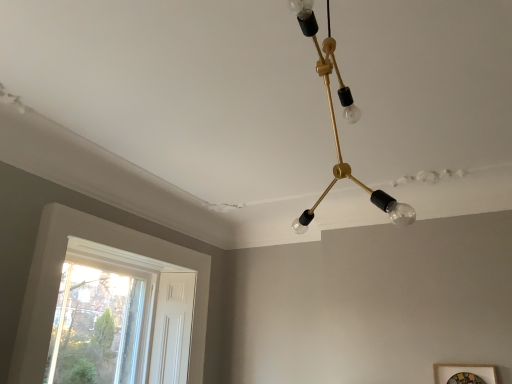
Question: Could you tell me if white wood window at lower left is turned towards wooden picture frame at lower right?

Choices:
 (A) no
 (B) yes

Answer: (B)

Question: Does white wood window at lower left have a larger size compared to wooden picture frame at lower right?

Choices:
 (A) no
 (B) yes

Answer: (B)

Question: Considering the relative sizes of white wood window at lower left and wooden picture frame at lower right in the image provided, is white wood window at lower left wider than wooden picture frame at lower right?

Choices:
 (A) yes
 (B) no

Answer: (A)

Question: Is white wood window at lower left completely or partially outside of wooden picture frame at lower right?

Choices:
 (A) yes
 (B) no

Answer: (A)

Question: From a real-world perspective, is white wood window at lower left under wooden picture frame at lower right?

Choices:
 (A) yes
 (B) no

Answer: (B)

Question: Is white wood window at lower left positioned in front of wooden picture frame at lower right?

Choices:
 (A) no
 (B) yes

Answer: (A)

Question: Does gold metallic chandelier at upper center have a greater width compared to wooden picture frame at lower right?

Choices:
 (A) no
 (B) yes

Answer: (B)

Question: Is gold metallic chandelier at upper center oriented away from wooden picture frame at lower right?

Choices:
 (A) no
 (B) yes

Answer: (B)

Question: Can you confirm if gold metallic chandelier at upper center is bigger than wooden picture frame at lower right?

Choices:
 (A) yes
 (B) no

Answer: (A)

Question: Does gold metallic chandelier at upper center lie behind wooden picture frame at lower right?

Choices:
 (A) no
 (B) yes

Answer: (A)

Question: From a real-world perspective, does gold metallic chandelier at upper center sit lower than wooden picture frame at lower right?

Choices:
 (A) no
 (B) yes

Answer: (A)

Question: Does gold metallic chandelier at upper center lie in front of wooden picture frame at lower right?

Choices:
 (A) yes
 (B) no

Answer: (A)

Question: Is gold metallic chandelier at upper center bigger than white wood window at lower left?

Choices:
 (A) yes
 (B) no

Answer: (A)